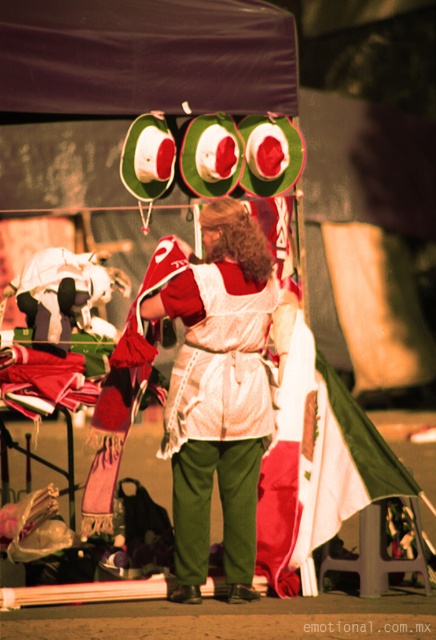
You are a customer at the night market and want to locate the black fabric canopy at upper center and the white cotton apron at center. According to the scene, which object is positioned to the left of the other?

The black fabric canopy at upper center is to the left of the white cotton apron at center.

You are a customer at the night market and want to buy a black fabric canopy at upper center. The vendor is wearing a white cotton apron at center. Which item is larger in size?

The black fabric canopy at upper center is bigger than the white cotton apron at center.

You are a customer approaching the vendor at night. Which item would you see first as you walk towards the stall, the black fabric canopy at upper center or the white cotton apron at center?

The black fabric canopy at upper center is closer to the viewer than the white cotton apron at center, so you would see the black fabric canopy at upper center first as you approach the stall.